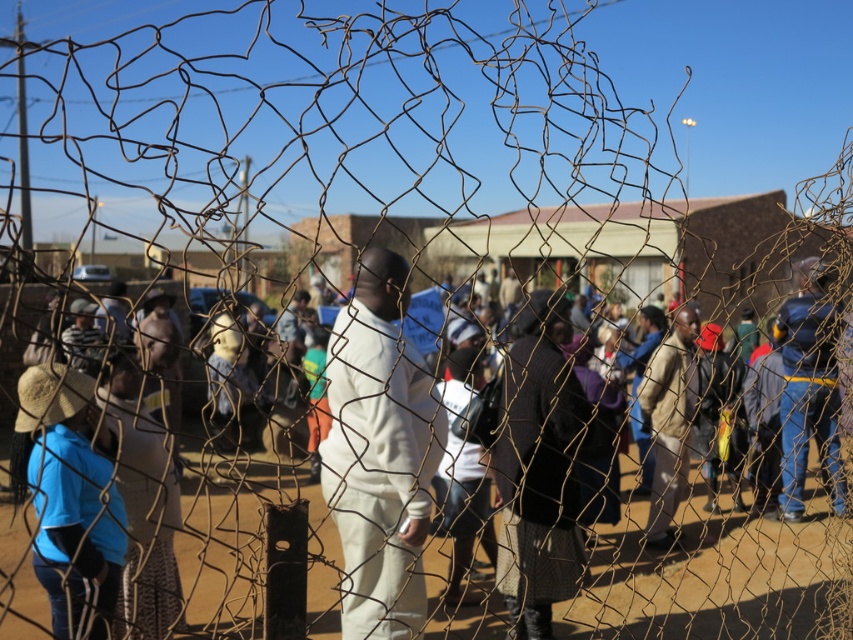
Looking at this image, you are a photographer trying to capture a clear shot of the dark brown textured coat at center through the wire mesh fence at center. Based on their sizes, do you think the fence will block your view of the coat?

The wire mesh fence at center is not as tall as the dark brown textured coat at center, so the fence will not fully block the view of the coat since it is shorter in height.

You are observing a protest through a fence. You notice two people in the crowd wearing white matte pants at center and dark brown textured coat at center. Which clothing item is positioned more to the left side of the scene?

The white matte pants at center are positioned more to the left side of the scene compared to the dark brown textured coat at center.